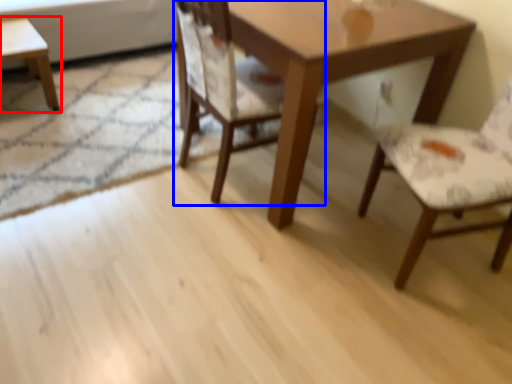
Question: Among these objects, which one is nearest to the camera, coffee table (highlighted by a red box) or chair (highlighted by a blue box)?

Choices:
 (A) coffee table
 (B) chair

Answer: (B)